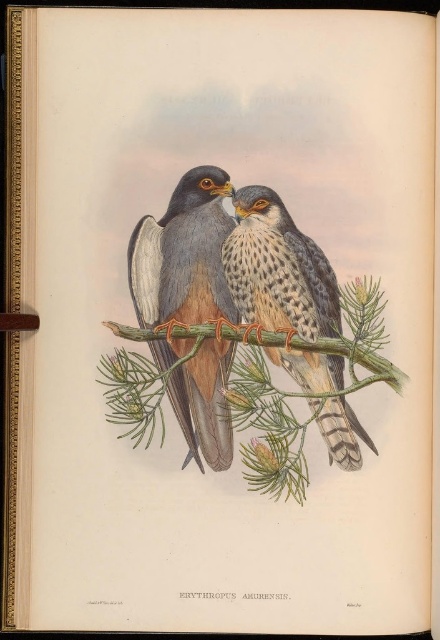
You are a photographer trying to capture a closeup of the bird on the left. You notice two points marked in the image, point 1 at coordinates point (172, 275) and point 2 at coordinates point (256, 310). Which point should you focus on to get the best closeup of the bird on the left?

Point (172, 275) is closer to the camera than point (256, 310), so focusing on point (172, 275) will provide a better closeup of the bird on the left.